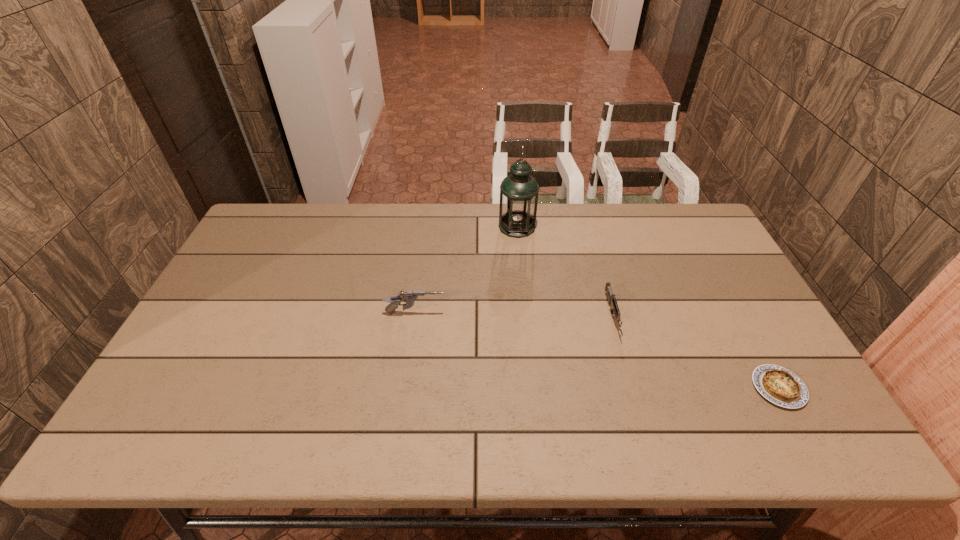
Identify which object is the third closest to the rightmost object. Please provide its 2D coordinates. Your answer should be formatted as a tuple, i.e. [(x, y)], where the tuple contains the x and y coordinates of a point satisfying the conditions above.

[(410, 297)]

The width and height of the screenshot is (960, 540). Identify the location of object that is the closest to the farthest object. (612, 300).

Where is `free space in the image that satisfies the following two spatial constraints: 1. at the barrel of the nearest object; 2. on the left side of the left gun`? The height and width of the screenshot is (540, 960). free space in the image that satisfies the following two spatial constraints: 1. at the barrel of the nearest object; 2. on the left side of the left gun is located at coordinates (405, 388).

At what (x,y) coordinates should I click in order to perform the action: click on free space that satisfies the following two spatial constraints: 1. aimed along the barrel of the shortest object; 2. on the left side of the second shortest object. Please return your answer as a coordinate pair (x, y). Looking at the image, I should click on (633, 388).

At what (x,y) coordinates should I click in order to perform the action: click on vacant region that satisfies the following two spatial constraints: 1. on the front side of the shortest object; 2. on the left side of the tallest object. Please return your answer as a coordinate pair (x, y). This screenshot has width=960, height=540. Looking at the image, I should click on (533, 388).

Where is `free region that satisfies the following two spatial constraints: 1. aimed along the barrel of the quiche; 2. on the left side of the second shortest object`? This screenshot has width=960, height=540. free region that satisfies the following two spatial constraints: 1. aimed along the barrel of the quiche; 2. on the left side of the second shortest object is located at coordinates (633, 388).

Image resolution: width=960 pixels, height=540 pixels. I want to click on free space that satisfies the following two spatial constraints: 1. aimed along the barrel of the shorter gun; 2. on the left side of the nearest object, so click(633, 388).

Locate an element on the screen. free space that satisfies the following two spatial constraints: 1. at the barrel of the taller gun; 2. on the back side of the rightmost object is located at coordinates coord(405,388).